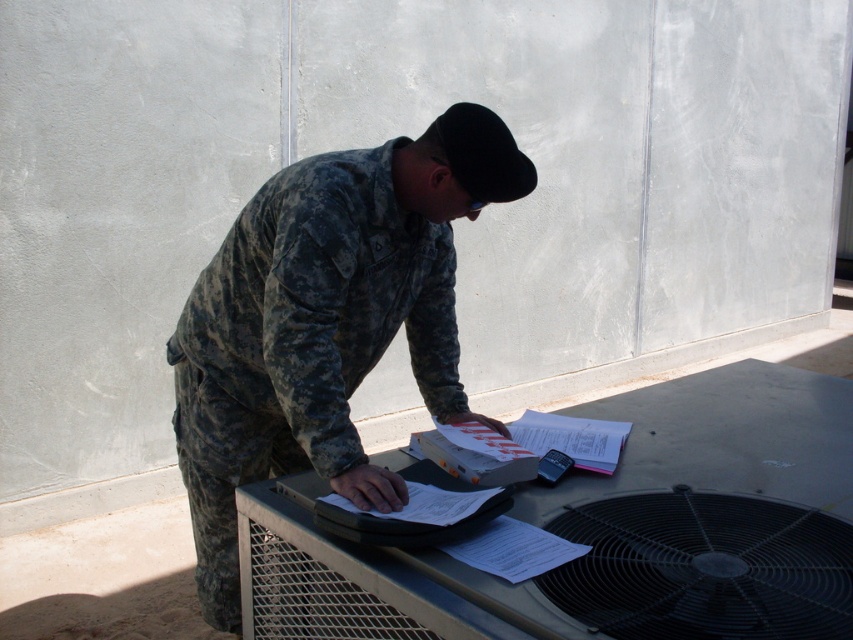
Question: Does camouflage uniform at center appear over black metallic mechanical fan at lower right?

Choices:
 (A) no
 (B) yes

Answer: (B)

Question: Which of the following is the closest to the observer?

Choices:
 (A) (320, 156)
 (B) (585, 620)

Answer: (B)

Question: Is camouflage uniform at center to the left of black metallic mechanical fan at lower right from the viewer's perspective?

Choices:
 (A) no
 (B) yes

Answer: (B)

Question: Does camouflage uniform at center have a greater width compared to black metallic mechanical fan at lower right?

Choices:
 (A) no
 (B) yes

Answer: (B)

Question: Which object appears farthest from the camera in this image?

Choices:
 (A) black metallic mechanical fan at lower right
 (B) camouflage uniform at center

Answer: (B)